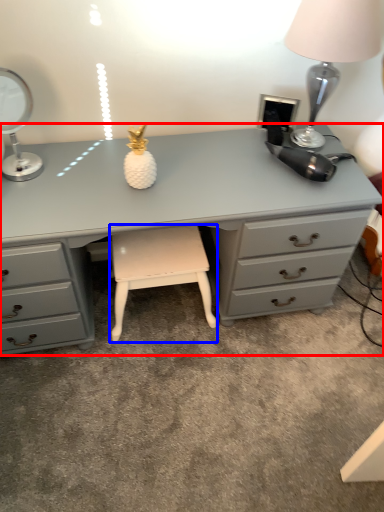
Question: Which object is further to the camera taking this photo, desk (highlighted by a red box) or stool (highlighted by a blue box)?

Choices:
 (A) desk
 (B) stool

Answer: (B)